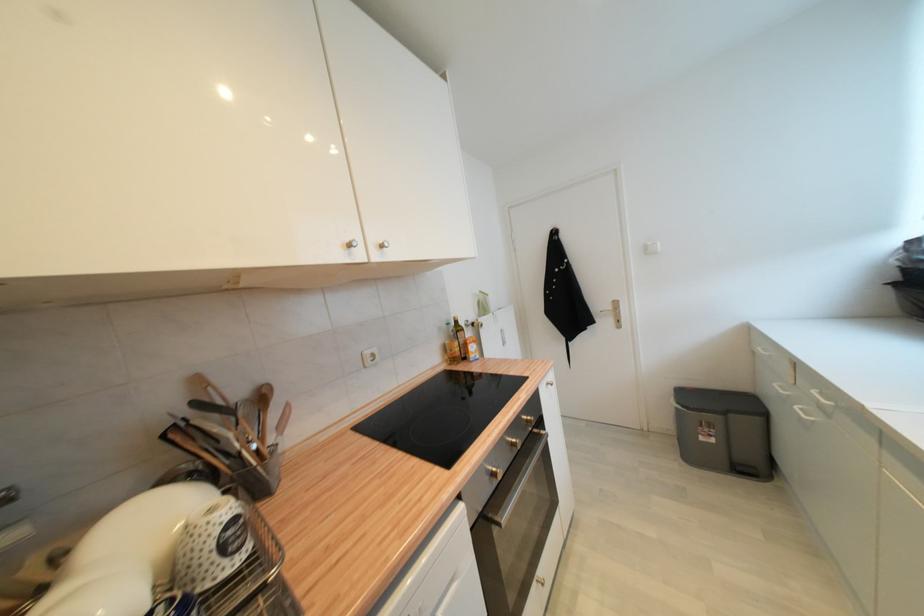
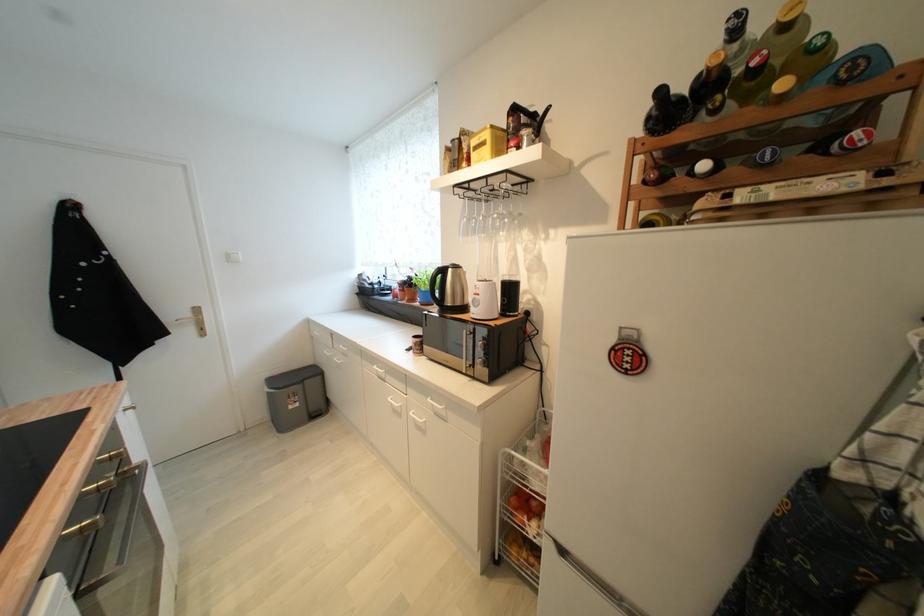
The point at (707, 440) is marked in the first image. Where is the corresponding point in the second image?

(296, 408)